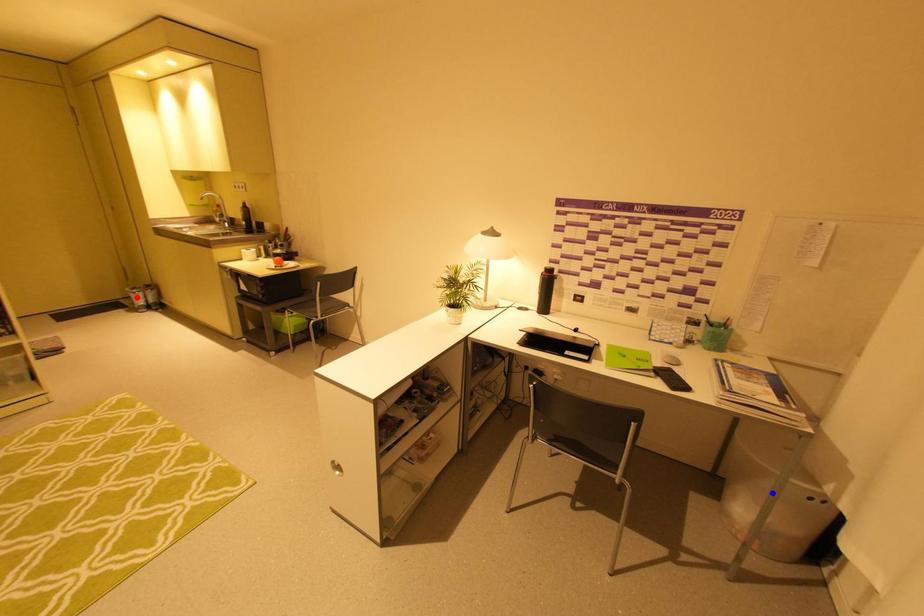
Question: In the image, two points are highlighted. Which point is nearer to the camera? Reply with the corresponding letter.

Choices:
 (A) blue point
 (B) red point

Answer: (A)